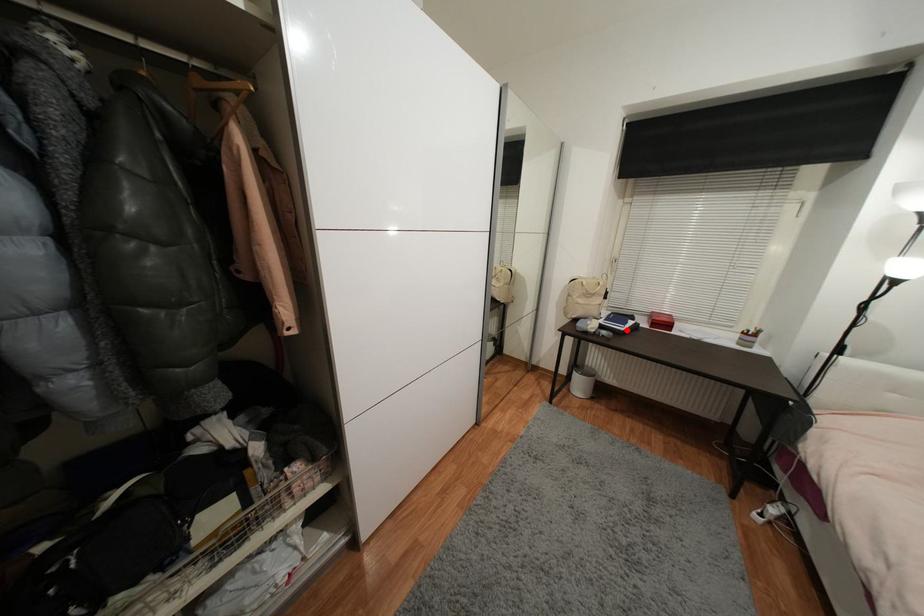
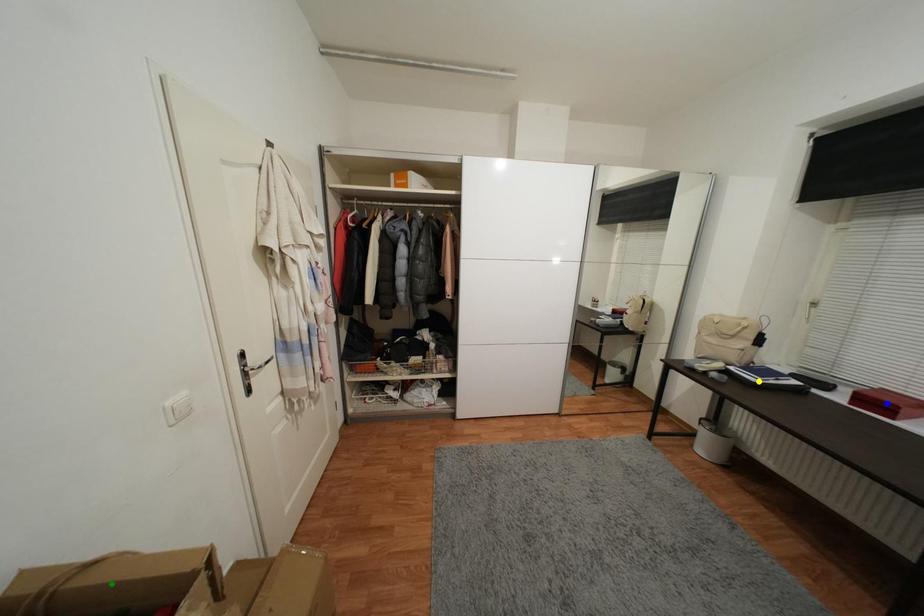
Question: I am providing you with two images of the same scene from different viewpoints. A red point is marked on the first image. You are given multiple points on the second image. Which mark in image 2 goes with the point in image 1?

Choices:
 (A) green point
 (B) yellow point
 (C) blue point

Answer: (B)